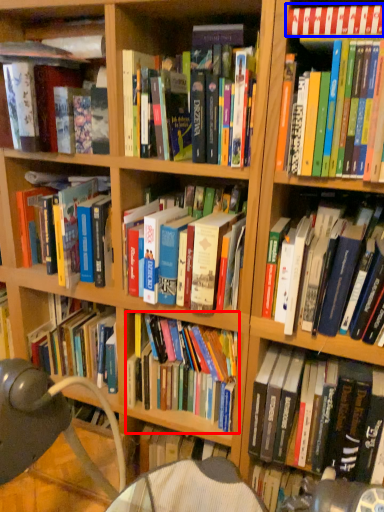
Question: Which of the following is the closest to the observer, book (highlighted by a red box) or book (highlighted by a blue box)?

Choices:
 (A) book
 (B) book

Answer: (B)